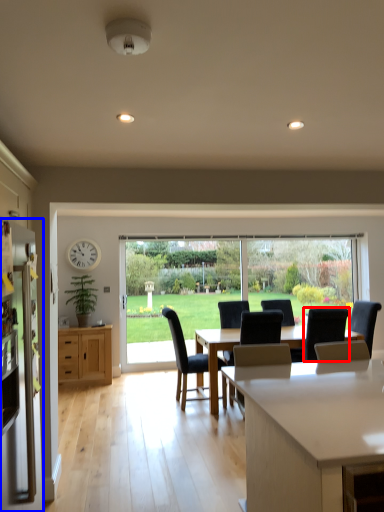
Question: Which object is further to the camera taking this photo, chair (highlighted by a red box) or refrigerator (highlighted by a blue box)?

Choices:
 (A) chair
 (B) refrigerator

Answer: (A)